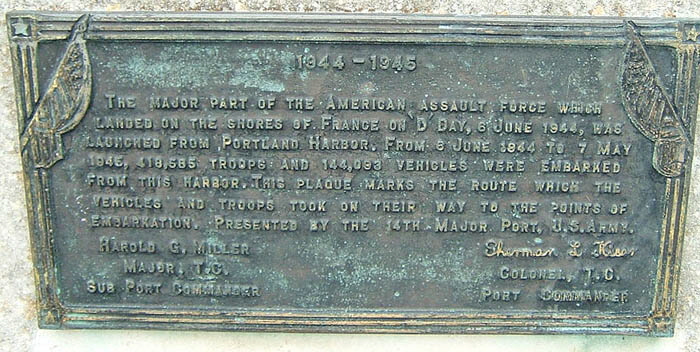
Find the location of a particular element. Image resolution: width=700 pixels, height=352 pixels. bottom right corner of plaque is located at coordinates (662, 327).